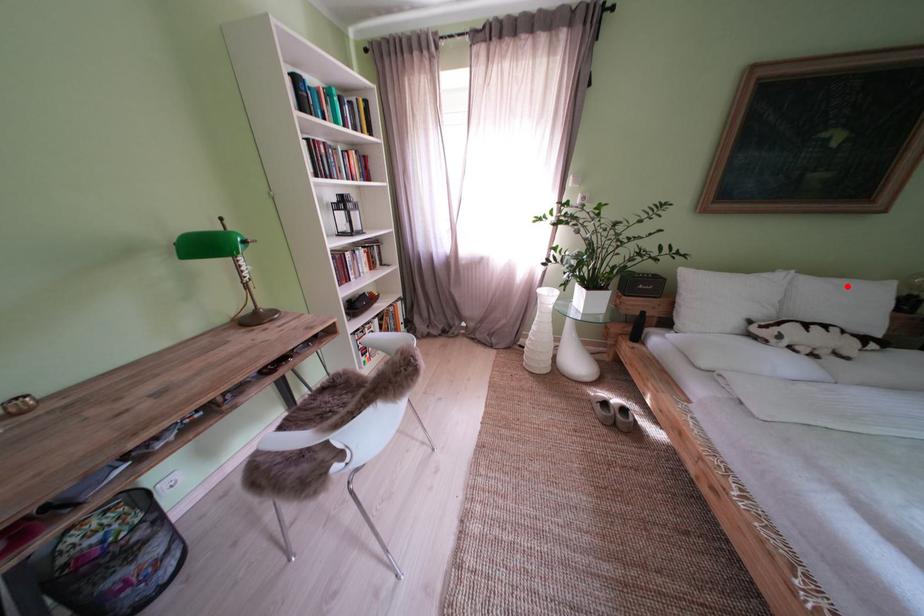
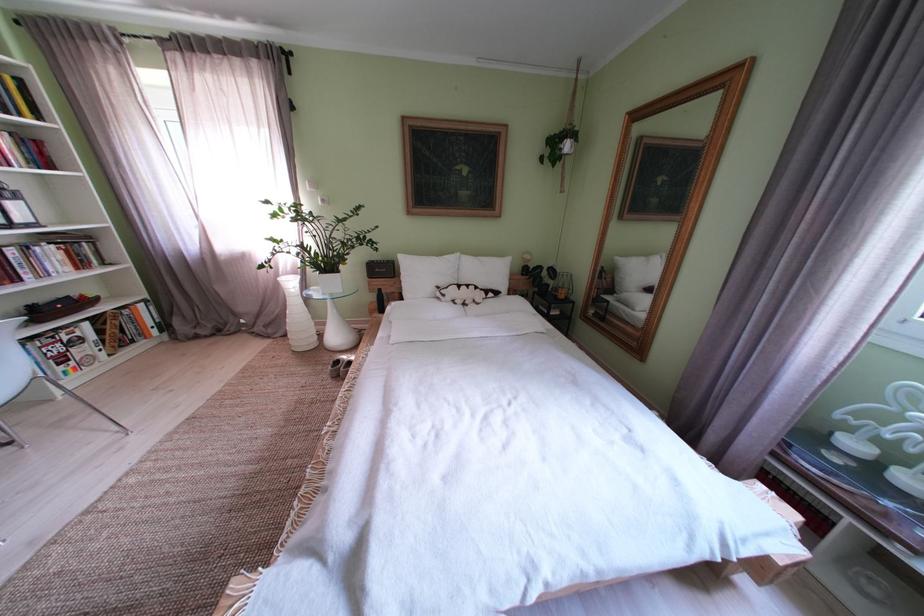
Question: I am providing you with two images of the same scene from different viewpoints. A red point is shown in image1. For the corresponding object point in image2, is it positioned nearer or farther from the camera?

Choices:
 (A) Nearer
 (B) Farther

Answer: (A)